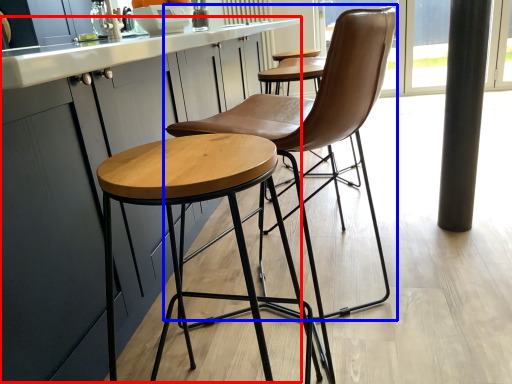
Question: Which point is further to the camera, counter top (highlighted by a red box) or chair (highlighted by a blue box)?

Choices:
 (A) counter top
 (B) chair

Answer: (B)